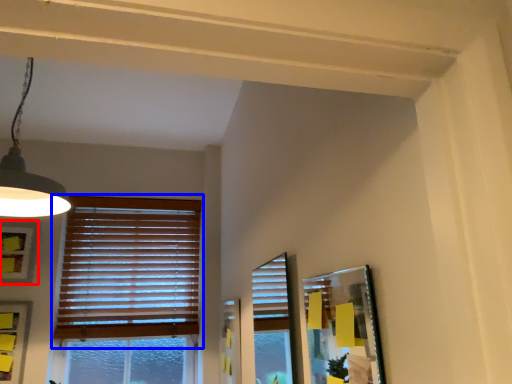
Question: Which object is closer to the camera taking this photo, picture frame (highlighted by a red box) or window blind (highlighted by a blue box)?

Choices:
 (A) picture frame
 (B) window blind

Answer: (A)